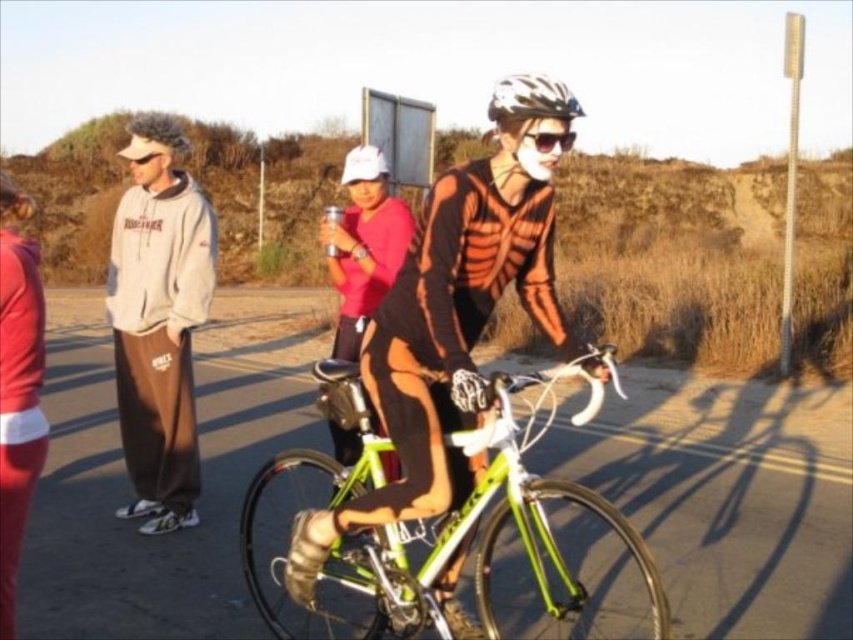
Question: From the image, what is the correct spatial relationship of white hoodie at left in relation to matte pink hoodie at lower left?

Choices:
 (A) below
 (B) above

Answer: (B)

Question: Which of the following is the farthest from the observer?

Choices:
 (A) matte red shirt at center
 (B) green metallic bicycle at center
 (C) white matte bicycle helmet at upper center
 (D) sunglasses matte at center

Answer: (A)

Question: Is white matte bicycle helmet at upper center below sunglasses matte at center?

Choices:
 (A) yes
 (B) no

Answer: (B)

Question: From the image, what is the correct spatial relationship of white hoodie at left in relation to sunglasses matte at center?

Choices:
 (A) right
 (B) left

Answer: (B)

Question: Among these points, which one is nearest to the camera?

Choices:
 (A) (624, 396)
 (B) (552, 148)

Answer: (B)

Question: Which of these objects is positioned farthest from the green metallic bicycle at center?

Choices:
 (A) sunglasses matte at center
 (B) matte red shirt at center

Answer: (A)